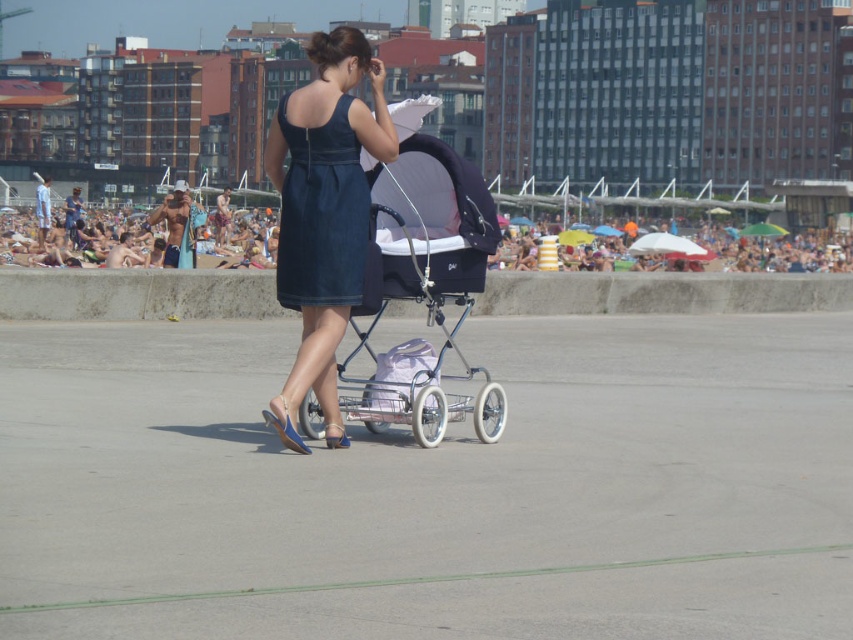
Can you confirm if matte black baby carriage at center is positioned above dark denim dress at center?

Incorrect, matte black baby carriage at center is not positioned above dark denim dress at center.

Is point (409, 179) less distant than point (318, 136)?

No, (409, 179) is behind (318, 136).

Who is more distant from viewer, (421, 220) or (315, 145)?

Point (421, 220)

What are the coordinates of `matte black baby carriage at center` in the screenshot? It's located at (425, 282).

Who is lower down, matte black baby carriage at center or multicolored umbrellas at upper center?

matte black baby carriage at center

Is point (381, 186) positioned before point (224, 253)?

Yes, point (381, 186) is closer to viewer.

At what (x,y) coordinates should I click in order to perform the action: click on matte black baby carriage at center. Please return your answer as a coordinate pair (x, y). The height and width of the screenshot is (640, 853). Looking at the image, I should click on (425, 282).

Is the position of dark denim dress at center less distant than that of multicolored umbrellas at upper center?

Yes, dark denim dress at center is closer to the viewer.

Is dark denim dress at center wider than multicolored umbrellas at upper center?

No, dark denim dress at center is not wider than multicolored umbrellas at upper center.

Between point (288, 214) and point (244, 246), which one is positioned behind?

Point (244, 246)

Locate an element on the screen. The image size is (853, 640). dark denim dress at center is located at coordinates (322, 212).